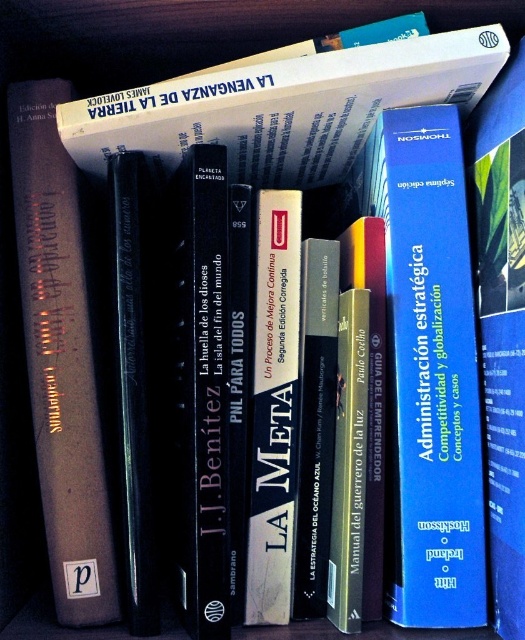
You are standing in front of a bookshelf and want to reach a point marked at coordinates point [459,156]. If your arm can extend 25 inches, can you reach that point?

The point [459,156] is 27.10 inches from the camera, which is beyond your arm extension of 25 inches. You cannot reach it.

You are organizing a bookshelf and need to place the blue hardcover book at center and the matte gray book at left. Based on their positions in the image, which book should you place first to maintain the correct arrangement?

You should place the matte gray book at left first because the blue hardcover book at center is to the right of it, so positioning the gray one first allows you to place the blue one correctly to its right.

You are organizing a bookshelf and notice the blue hardcover book at center. Based on its position, can you determine if it is placed closer to the top or bottom of the shelf?

The blue hardcover book at center is located at point 0.815 on the vertical axis, which indicates it is closer to the bottom of the shelf since lower values on the vertical axis typically represent lower positions.